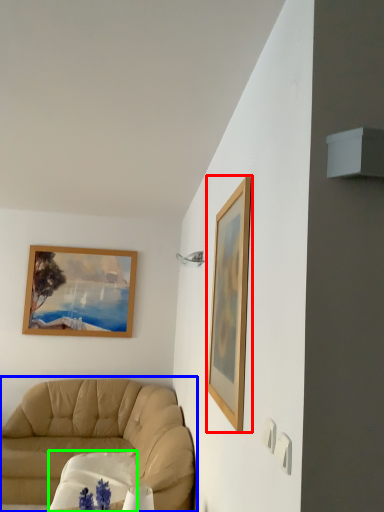
Question: Based on their relative distances, which object is nearer to picture frame (highlighted by a red box)? Choose from studio couch (highlighted by a blue box) and round table (highlighted by a green box).

Choices:
 (A) studio couch
 (B) round table

Answer: (B)